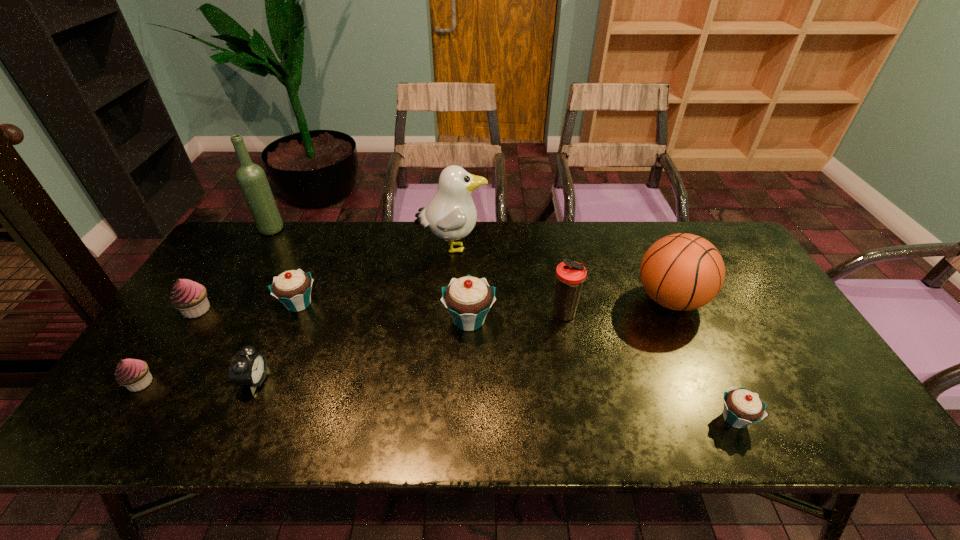
Find the location of a particular element. the second closest teal cupcake relative to the nearest object is located at coordinates (292, 288).

Image resolution: width=960 pixels, height=540 pixels. In order to click on teal cupcake that stands as the closest to the basketball in this screenshot , I will do `click(741, 407)`.

Image resolution: width=960 pixels, height=540 pixels. I want to click on vacant region that satisfies the following two spatial constraints: 1. on the beak of the rightmost cupcake; 2. on the left side of the white gull, so click(440, 418).

The width and height of the screenshot is (960, 540). I want to click on vacant space that satisfies the following two spatial constraints: 1. on the front side of the nearest cupcake; 2. on the left side of the alarm clock, so click(238, 418).

The width and height of the screenshot is (960, 540). In order to click on vacant space that satisfies the following two spatial constraints: 1. on the front side of the third object from right to left; 2. on the left side of the smallest teal cupcake in this screenshot , I will do `click(585, 418)`.

The width and height of the screenshot is (960, 540). I want to click on blank space that satisfies the following two spatial constraints: 1. on the front side of the brown thermos bottle; 2. on the left side of the third cupcake from left to right, so (x=294, y=315).